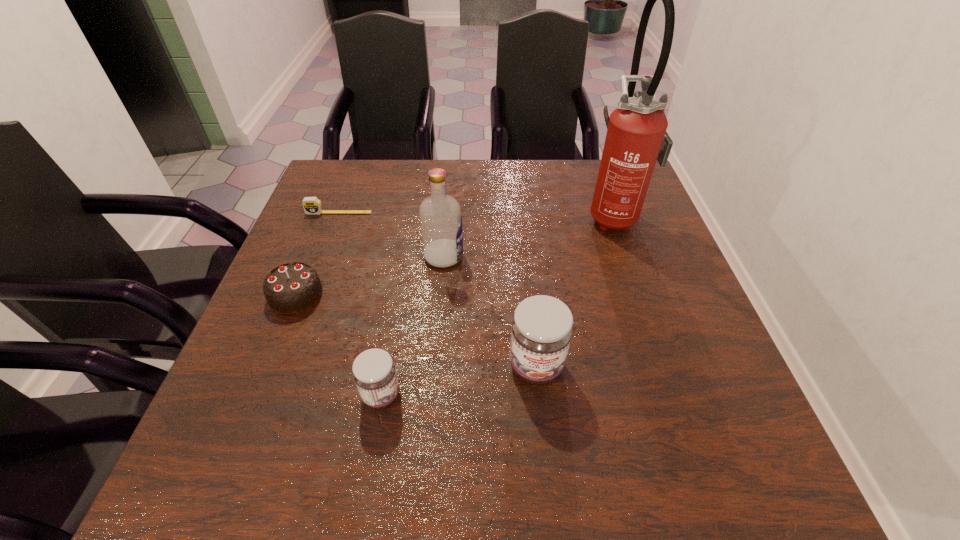
In order to click on the left jam in this screenshot , I will do `click(374, 372)`.

The image size is (960, 540). Identify the location of the third object from left to right. (374, 372).

Image resolution: width=960 pixels, height=540 pixels. Find the location of `the taller jam`. the taller jam is located at coordinates (541, 330).

The width and height of the screenshot is (960, 540). In order to click on the right jam in this screenshot , I will do `click(541, 330)`.

Find the location of `vodka`. vodka is located at coordinates (440, 216).

You are a GUI agent. You are given a task and a screenshot of the screen. Output one action in this format:
    pyautogui.click(x=<x>, y=<y>)
    Task: Click on the fifth shortest object
    Image resolution: width=960 pixels, height=540 pixels.
    Given the screenshot: What is the action you would take?
    440,216

You are a GUI agent. You are given a task and a screenshot of the screen. Output one action in this format:
    pyautogui.click(x=<x>, y=<y>)
    Task: Click on the fire extinguisher
    
    Given the screenshot: What is the action you would take?
    (x=636, y=138)

Where is `the tallest object`? The width and height of the screenshot is (960, 540). the tallest object is located at coordinates (636, 138).

What are the coordinates of `the shortest object` in the screenshot? It's located at tap(312, 205).

Find the location of a particular element. the fifth tallest object is located at coordinates (291, 288).